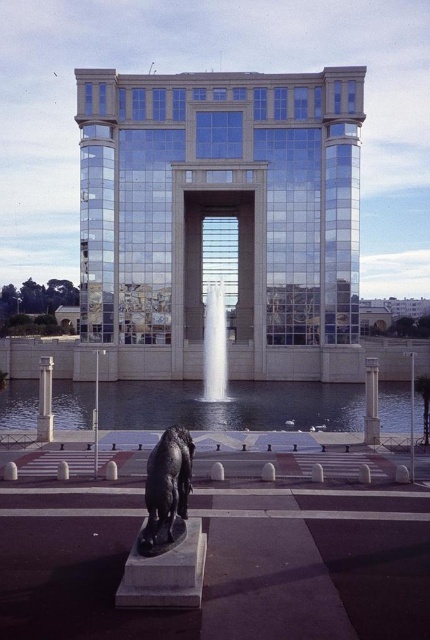
In the scene shown: You are standing in front of the modern building and want to determine the relative positions of two points marked in the scene. The first point is at coordinates point [181,477] and the second is at point [369,378]. Which point is closer to you?

Point [181,477] is closer to the viewer than point [369,378].

You are standing in front of the modern building and want to place a small flower pot between the polished bronze statue at lower left and the slate gray stone pillar at center. Can you do this without moving either object?

The polished bronze statue at lower left is located above the slate gray stone pillar at center, so there is no space between them horizontally to place the flower pot. You would need to move one of the objects to create space.